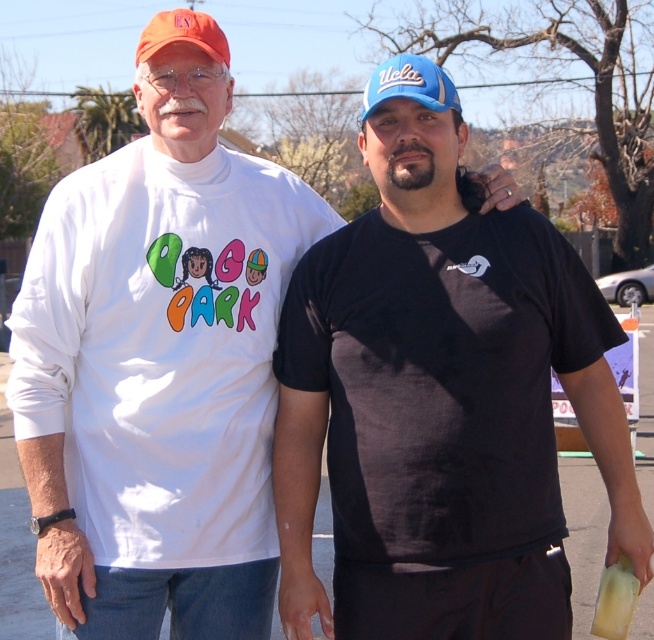
Is black matte t-shirt at center shorter than white matte t-shirt at left?

No.

The image size is (654, 640). What do you see at coordinates (441, 404) in the screenshot? I see `black matte t-shirt at center` at bounding box center [441, 404].

Which is in front, point (468, 419) or point (95, 221)?

Point (468, 419)

Where is `black matte t-shirt at center`? The image size is (654, 640). black matte t-shirt at center is located at coordinates (441, 404).

Which is more to the right, white matte t-shirt at left or orange matte baseball cap at upper left?

white matte t-shirt at left is more to the right.

Who is taller, white matte t-shirt at left or orange matte baseball cap at upper left?

Standing taller between the two is orange matte baseball cap at upper left.

Who is more distant from viewer, (x=86, y=420) or (x=222, y=60)?

Positioned behind is point (x=222, y=60).

The width and height of the screenshot is (654, 640). In order to click on white matte t-shirt at left in this screenshot , I will do `click(162, 348)`.

Can you confirm if blue fabric baseball cap at upper center is positioned to the left of orange matte baseball cap at upper left?

Incorrect, blue fabric baseball cap at upper center is not on the left side of orange matte baseball cap at upper left.

Is point (402, 84) positioned behind point (156, 51)?

No, it is not.

Is point (439, 81) closer to viewer compared to point (148, 28)?

Yes, it is.

Where is `blue fabric baseball cap at upper center`? blue fabric baseball cap at upper center is located at coordinates (409, 84).